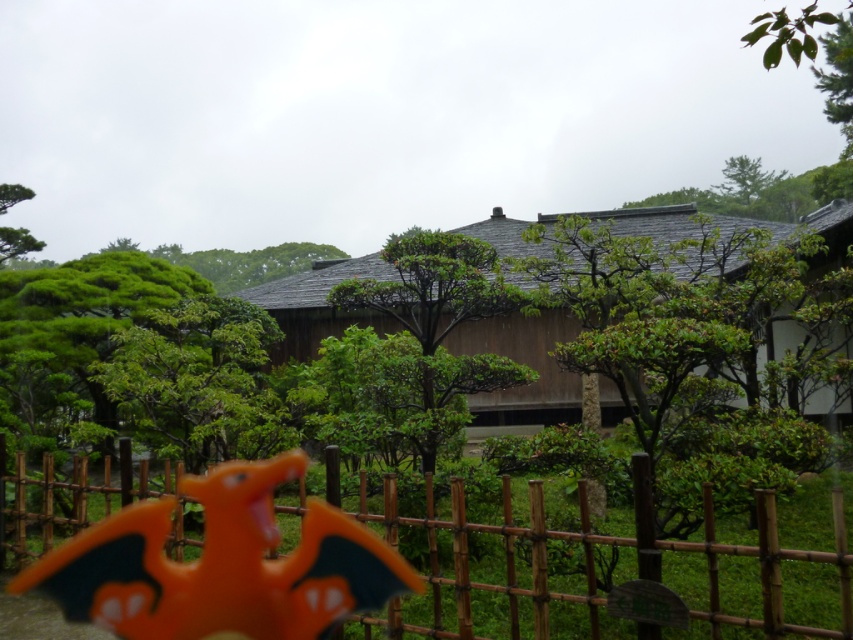
Looking at this image, does bamboo fence at lower center appear under green matte tree at center?

Yes, bamboo fence at lower center is below green matte tree at center.

Is bamboo fence at lower center further to camera compared to green matte tree at center?

No, bamboo fence at lower center is in front of green matte tree at center.

This screenshot has width=853, height=640. I want to click on bamboo fence at lower center, so click(368, 557).

Does bamboo fence at lower center appear on the right side of green leafy tree at upper center?

No, bamboo fence at lower center is not to the right of green leafy tree at upper center.

Between bamboo fence at lower center and green leafy tree at upper center, which one has less height?

With less height is bamboo fence at lower center.

Where is `bamboo fence at lower center`? Image resolution: width=853 pixels, height=640 pixels. bamboo fence at lower center is located at coordinates (368, 557).

Does green matte tree at center have a larger size compared to green leafy tree at upper center?

Correct, green matte tree at center is larger in size than green leafy tree at upper center.

Does green matte tree at center have a greater height compared to green leafy tree at upper center?

Indeed, green matte tree at center has a greater height compared to green leafy tree at upper center.

This screenshot has width=853, height=640. I want to click on green matte tree at center, so click(x=433, y=291).

In order to click on green matte tree at center in this screenshot , I will do `click(433, 291)`.